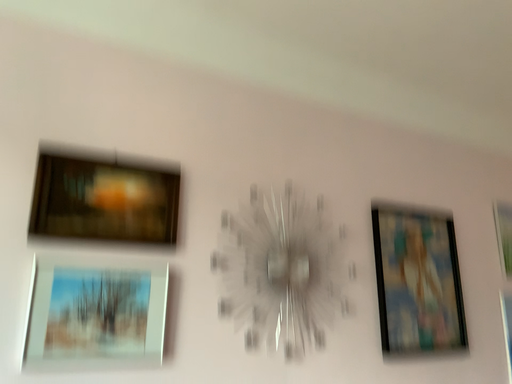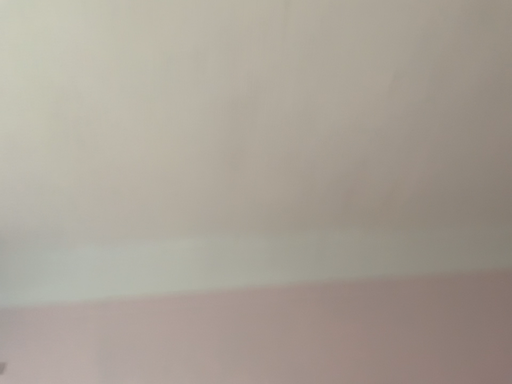
Question: Which way did the camera rotate in the video?

Choices:
 (A) rotated left
 (B) rotated right

Answer: (A)